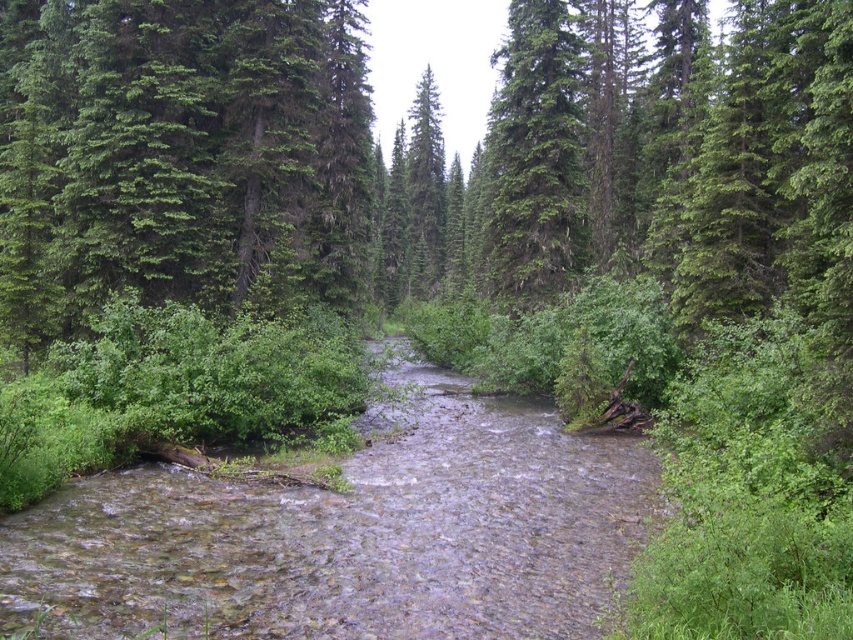
You are standing in the forest and want to cross the stream. You notice the clear water stream at center and the green textured tree at upper center. Which object is closer to you, and would stepping onto the rocks in the stream be safer compared to approaching the tree?

The clear water stream at center is closer to the viewer than the green textured tree at upper center. Stepping onto the rocks in the stream would be safer since the stream is closer, making the rocks more accessible. The tree is farther away, so approaching it would require moving further back into the scene.

You are a hiker trying to cross the clear water stream at center. There is a green textured tree at upper center above you. Can you use the tree to help you cross the stream safely?

The clear water stream at center is below the green textured tree at upper center. Since the tree is above the stream, you can use its branches or roots to steady yourself while crossing the stream safely.

From the picture: You are an explorer trying to cross the forest. You see the clear water stream at center and the green textured tree at upper center. Which one is taller?

The green textured tree at upper center is taller than the clear water stream at center.